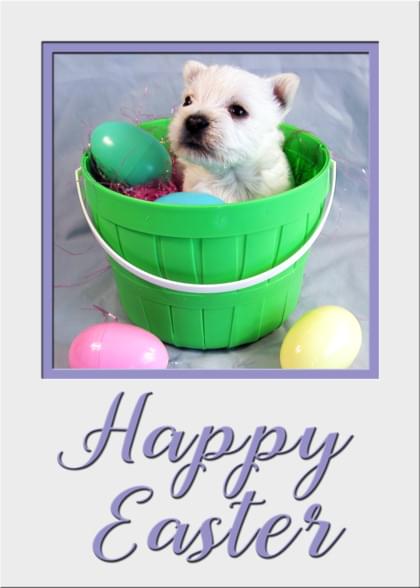
Where is `basket`? Image resolution: width=420 pixels, height=588 pixels. basket is located at coordinates (201, 243).